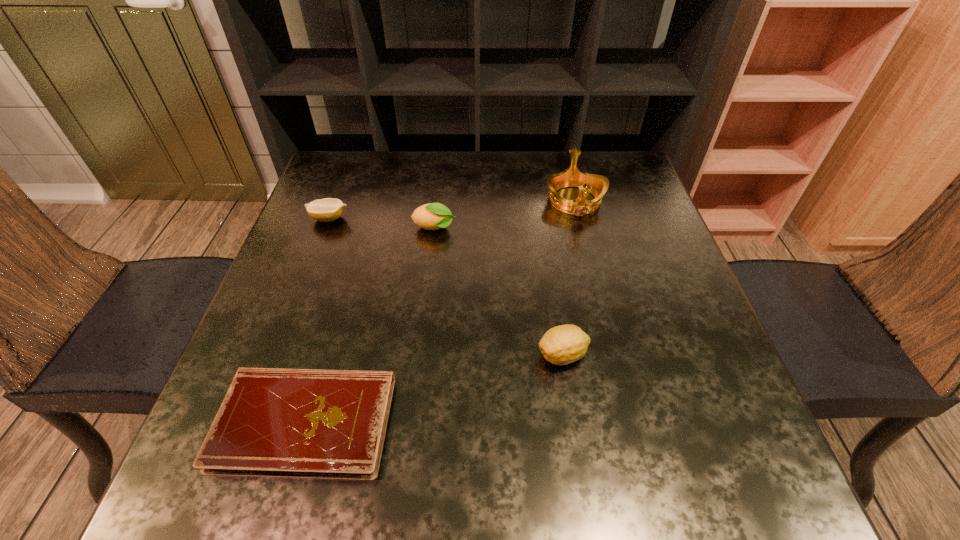
The image size is (960, 540). I want to click on object positioned at the near left corner, so click(293, 423).

Where is `object present at the far right corner`? The image size is (960, 540). object present at the far right corner is located at coordinates (597, 185).

Find the location of a particular element. This screenshot has width=960, height=540. free space at the far edge of the desktop is located at coordinates (478, 179).

Where is `vacant space at the near edge of the desktop`? Image resolution: width=960 pixels, height=540 pixels. vacant space at the near edge of the desktop is located at coordinates (306, 501).

Where is `free region at the left edge of the desktop`? The width and height of the screenshot is (960, 540). free region at the left edge of the desktop is located at coordinates (300, 341).

This screenshot has width=960, height=540. What are the coordinates of `blank area at the right edge` in the screenshot? It's located at (690, 287).

The height and width of the screenshot is (540, 960). Identify the location of blank region between the second lemon from left to right and the shortest lemon. (382, 224).

I want to click on vacant region between the second lemon from left to right and the tiara, so click(504, 214).

This screenshot has height=540, width=960. Identify the location of free space between the tallest object and the shortest lemon. (452, 210).

Find the location of a particular element. free spot between the shortest object and the second lemon from right to left is located at coordinates (370, 326).